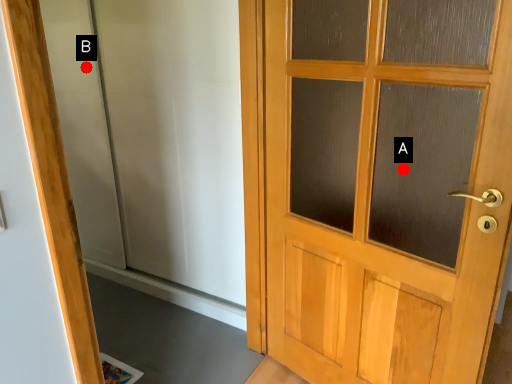
Question: Two points are circled on the image, labeled by A and B beside each circle. Which point is closer to the camera?

Choices:
 (A) A is closer
 (B) B is closer

Answer: (A)